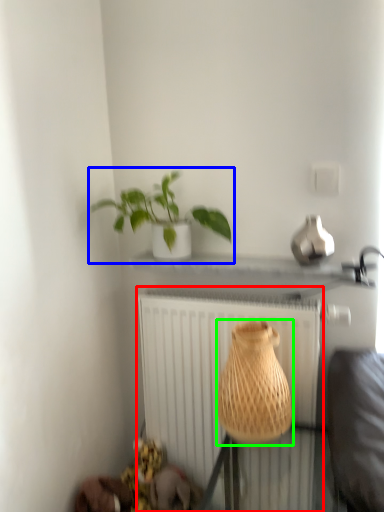
Question: Estimate the real-world distances between objects in this image. Which object is farther from radiator (highlighted by a red box), houseplant (highlighted by a blue box) or vase (highlighted by a green box)?

Choices:
 (A) houseplant
 (B) vase

Answer: (A)